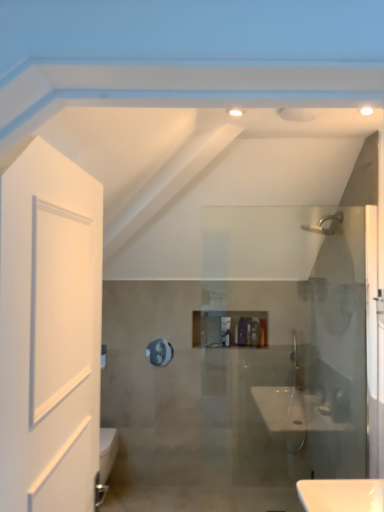
Question: Considering the positions of matte silver faucet at upper right and metallic reflective mirror at center in the image, is matte silver faucet at upper right bigger or smaller than metallic reflective mirror at center?

Choices:
 (A) small
 (B) big

Answer: (B)

Question: From a real-world perspective, is matte silver faucet at upper right above or below metallic reflective mirror at center?

Choices:
 (A) above
 (B) below

Answer: (A)

Question: Estimate the real-world distances between objects in this image. Which object is farther from the white matte door at left?

Choices:
 (A) matte purple bottle at center
 (B) metallic reflective mirror at center
 (C) matte silver faucet at upper right

Answer: (A)

Question: Estimate the real-world distances between objects in this image. Which object is closer to the white matte door at left?

Choices:
 (A) matte purple bottle at center
 (B) matte silver faucet at upper right
 (C) metallic reflective mirror at center

Answer: (B)